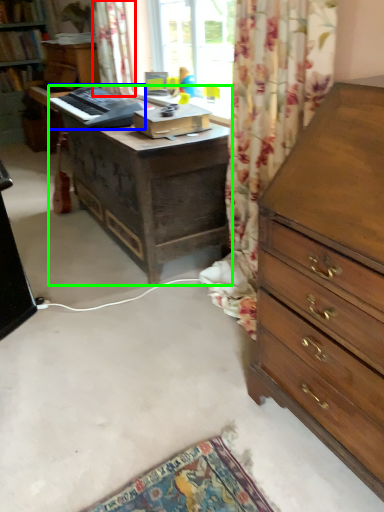
Question: Which object is positioned closest to curtain (highlighted by a red box)? Select from equipment (highlighted by a blue box) and desk (highlighted by a green box).

Choices:
 (A) equipment
 (B) desk

Answer: (A)